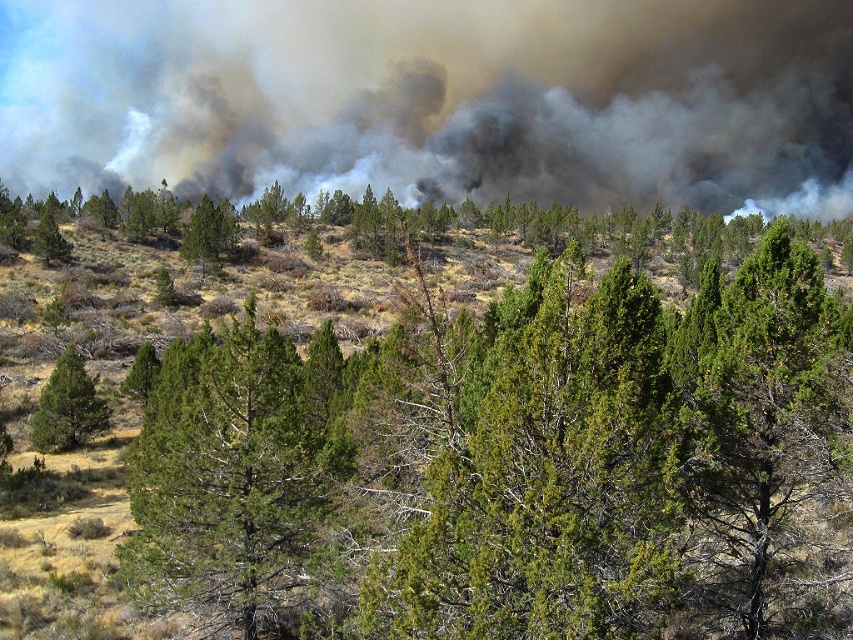
Question: Which point appears closest to the camera in this image?

Choices:
 (A) (294, 362)
 (B) (103, 404)

Answer: (A)

Question: Which point is closer to the camera?

Choices:
 (A) (486, 625)
 (B) (48, 433)

Answer: (A)

Question: Is green needle-like tree at center further to the viewer compared to green textured tree at left?

Choices:
 (A) yes
 (B) no

Answer: (B)

Question: Which point is farther from the camera taking this photo?

Choices:
 (A) (83, 400)
 (B) (616, 381)
 (C) (303, 586)

Answer: (A)

Question: Does green textured tree at center lie in front of green needle-like tree at center?

Choices:
 (A) no
 (B) yes

Answer: (B)

Question: Does green textured tree at center appear under green needle-like tree at center?

Choices:
 (A) yes
 (B) no

Answer: (B)